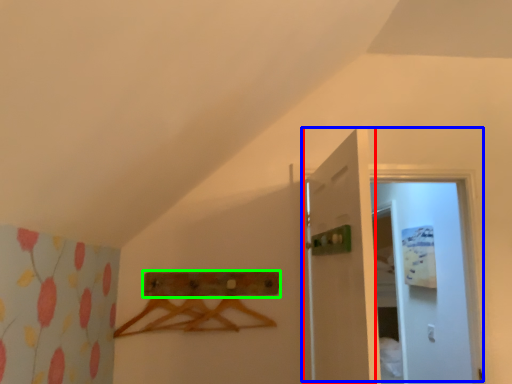
Question: Based on their relative distances, which object is nearer to door (highlighted by a red box)? Choose from door (highlighted by a blue box) and drawer (highlighted by a green box).

Choices:
 (A) door
 (B) drawer

Answer: (B)